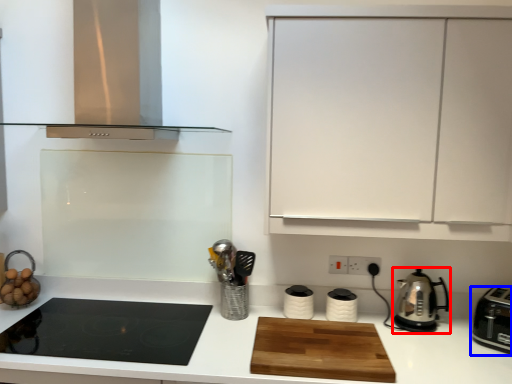
Question: Which of the following is the farthest to the observer, kitchen appliance (highlighted by a red box) or kitchen appliance (highlighted by a blue box)?

Choices:
 (A) kitchen appliance
 (B) kitchen appliance

Answer: (A)